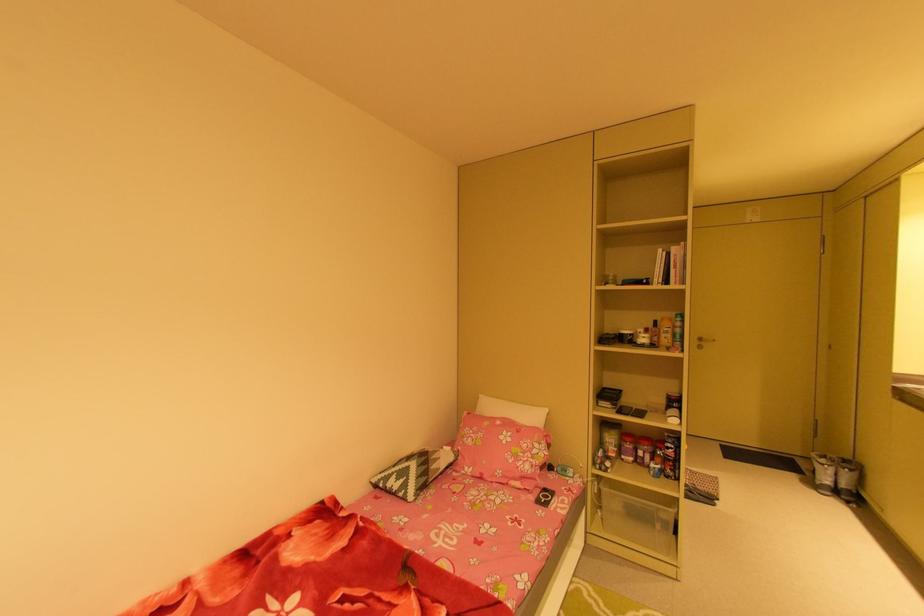
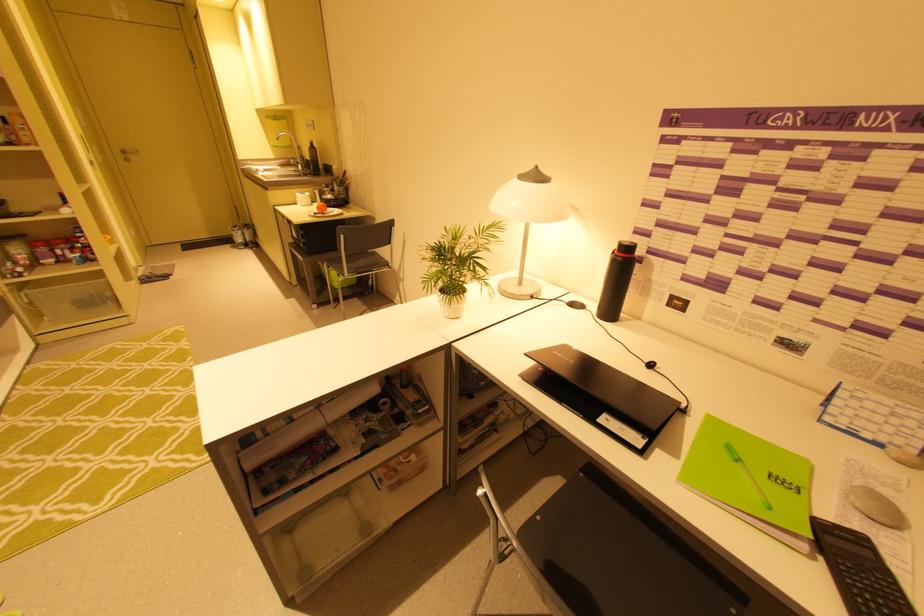
Find the pixel in the second image that matches point 704,339 in the first image.

(128, 152)